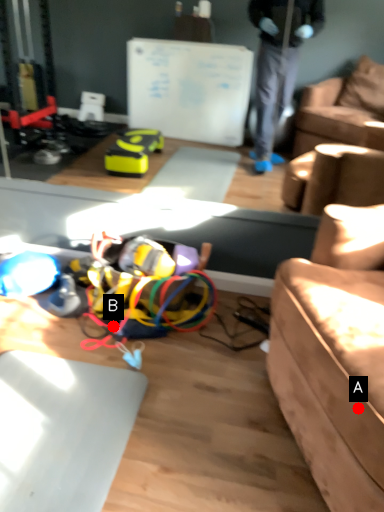
Question: Two points are circled on the image, labeled by A and B beside each circle. Among these points, which one is nearest to the camera?

Choices:
 (A) A is closer
 (B) B is closer

Answer: (A)